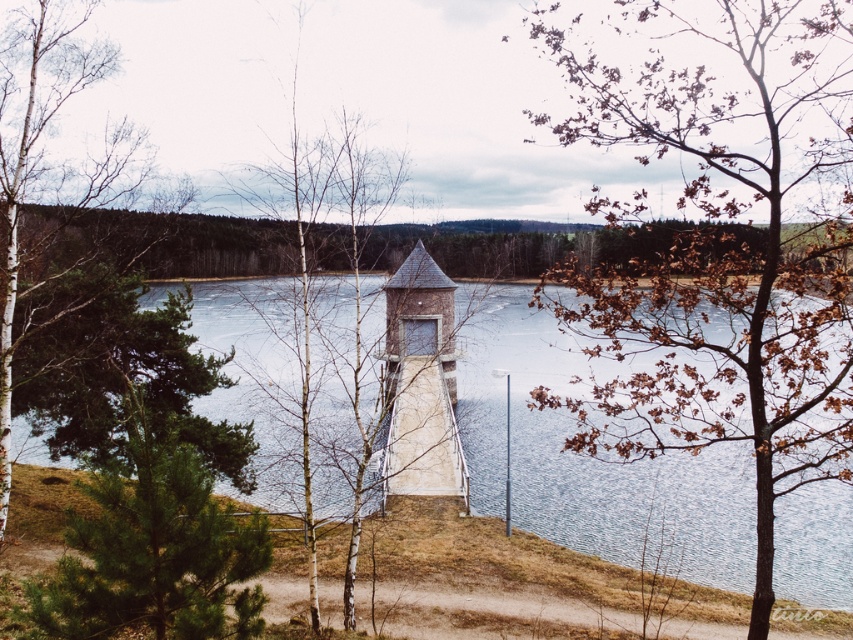
Looking at this image, you are standing at the point labeled point (723, 257) in the image. What object are you facing?

The point labeled point (723, 257) corresponds to the brown leafy tree at right, so you are facing the brown leafy tree at right.